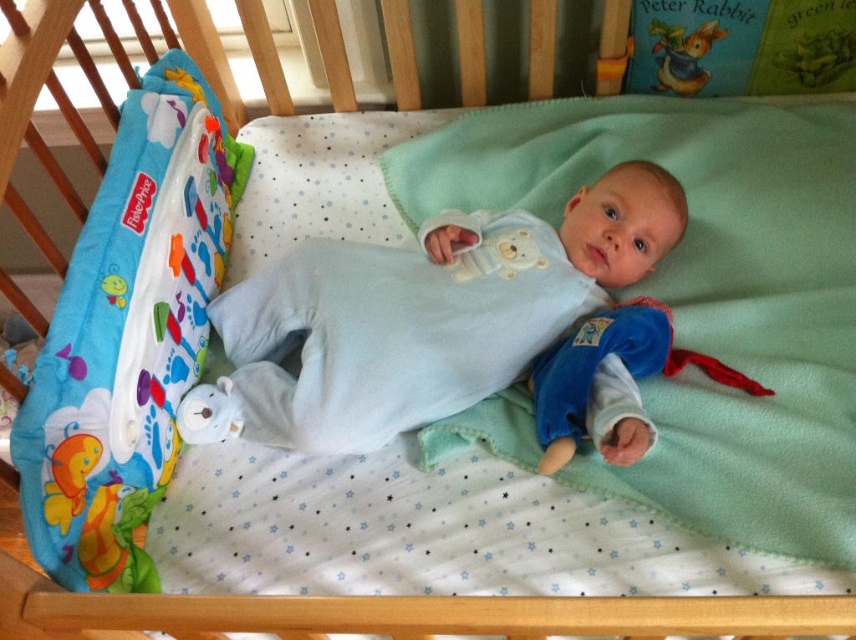
Question: Which object is the farthest from the light blue fleece onesie at center?

Choices:
 (A) green fleece blanket at center
 (B) rubber teething ring at lower right

Answer: (B)

Question: Which object appears closest to the camera in this image?

Choices:
 (A) light blue fleece onesie at center
 (B) rubber teething ring at lower right
 (C) green fleece blanket at center
 (D) green paper peter rabbit at upper right

Answer: (C)

Question: Does green paper peter rabbit at upper right appear under rubber teething ring at lower right?

Choices:
 (A) yes
 (B) no

Answer: (B)

Question: Is green fleece blanket at center above light blue fleece onesie at center?

Choices:
 (A) yes
 (B) no

Answer: (A)

Question: Among these points, which one is farthest from the camera?

Choices:
 (A) (402, 173)
 (B) (655, 58)
 (C) (620, 456)
 (D) (455, 272)

Answer: (A)

Question: Is green fleece blanket at center bigger than rubber teething ring at lower right?

Choices:
 (A) yes
 (B) no

Answer: (A)